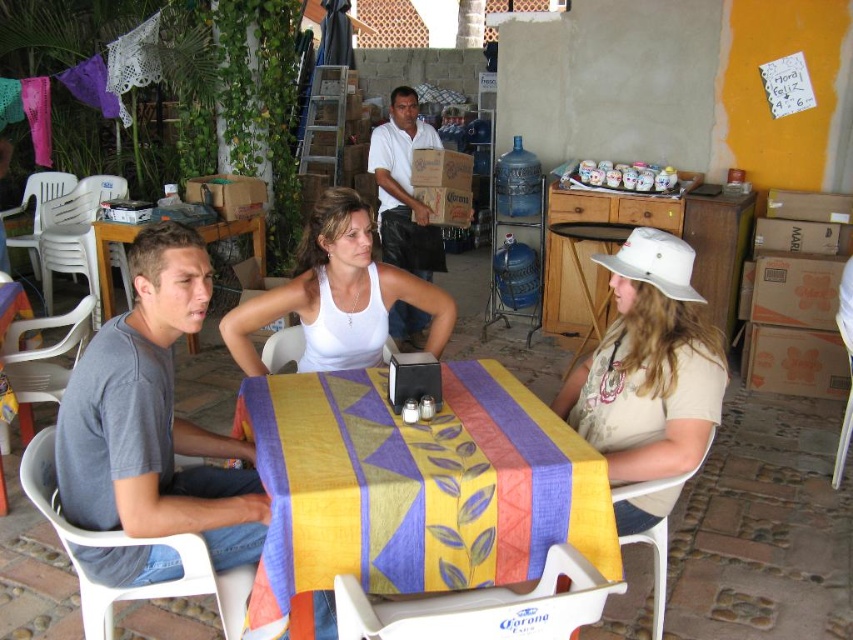
Between gray cotton t-shirt at left and beige cotton hat at center, which one appears on the right side from the viewer's perspective?

beige cotton hat at center is more to the right.

Between gray cotton t-shirt at left and beige cotton hat at center, which one is positioned lower?

Positioned lower is gray cotton t-shirt at left.

Is point (190, 246) behind point (618, 289)?

No, (190, 246) is in front of (618, 289).

This screenshot has width=853, height=640. I want to click on gray cotton t-shirt at left, so click(154, 417).

Describe the element at coordinates (413, 490) in the screenshot. I see `yellow fabric tablecloth at center` at that location.

Find the location of a particular element. Image resolution: width=853 pixels, height=640 pixels. yellow fabric tablecloth at center is located at coordinates (413, 490).

Is point (364, 545) more distant than point (228, 339)?

No.

What are the coordinates of `yellow fabric tablecloth at center` in the screenshot? It's located at (413, 490).

Who is positioned more to the right, white matte tank top at center or white cotton shirt at center?

white cotton shirt at center

Is point (326, 352) farther from camera compared to point (389, 134)?

No, (326, 352) is in front of (389, 134).

Find the location of `white matte tank top at center`. white matte tank top at center is located at coordinates (338, 296).